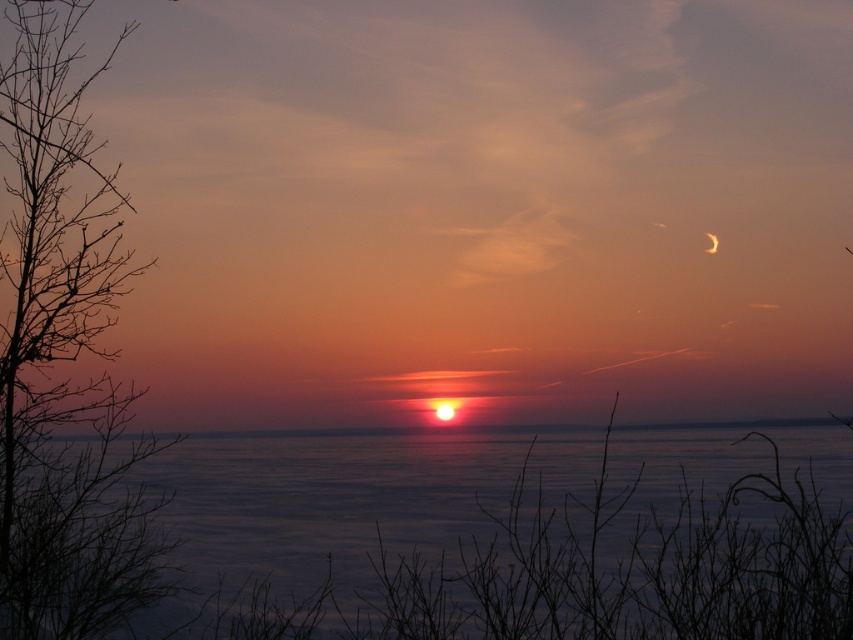
You are an artist painting the sunset scene. You need to decide which object to paint first based on their sizes. Which one is taller between the silhouette branch at left and the silvery metallic crescent at upper right?

The silhouette branch at left is taller than the silvery metallic crescent at upper right, so you should paint the silhouette branch at left first as it is taller.

Based on the photo, you are an astronomer observing the sunset scene. You notice the blue water at center and the silvery metallic crescent at upper right. Which object in the scene is bigger?

The blue water at center is larger in size compared to the silvery metallic crescent at upper right.

You are an observer standing at the edge of the water in the scene. You see the blue water at center and the silhouette branch at left. Which object is closer to your viewpoint?

The silhouette branch at left is closer to your viewpoint because it is positioned above the blue water at center, which is located below it.